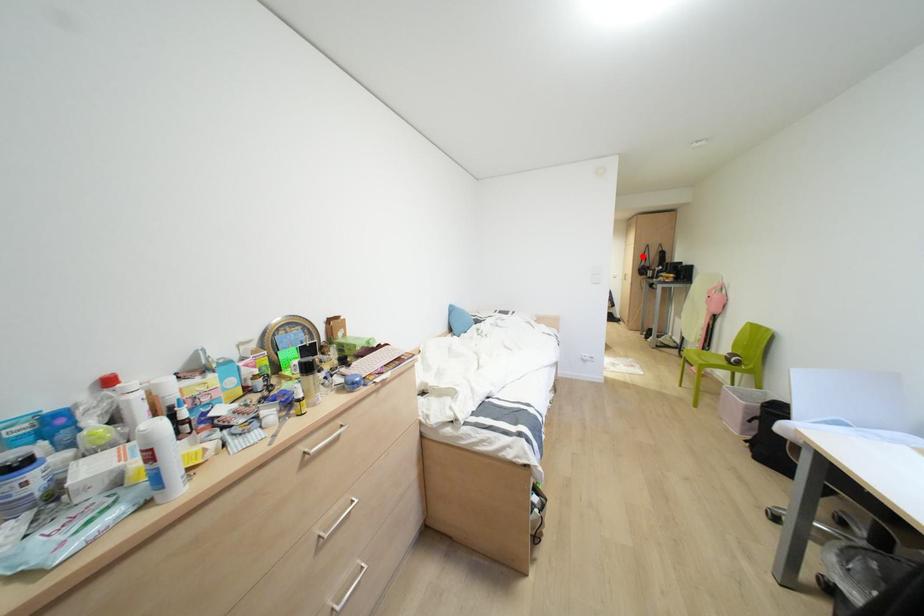
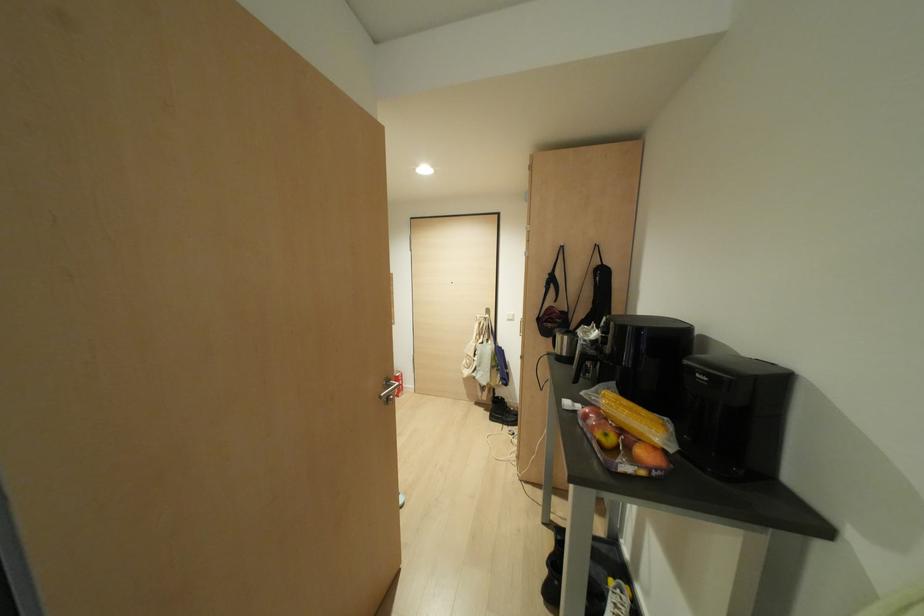
Locate, in the second image, the point that corresponds to the highlighted location in the first image.

(551, 280)